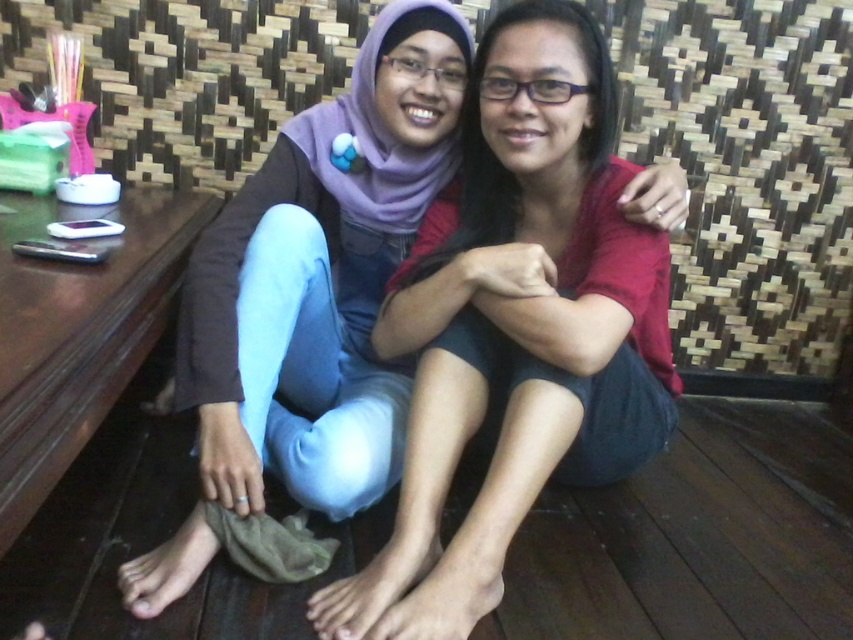
Does purple fabric hijab at center have a smaller size compared to brown wooden table at lower left?

Correct, purple fabric hijab at center occupies less space than brown wooden table at lower left.

Is point (485, 61) farther from viewer compared to point (140, 266)?

Yes, point (485, 61) is farther from viewer.

Is point (601, 138) more distant than point (18, 195)?

No, (601, 138) is in front of (18, 195).

The image size is (853, 640). I want to click on purple fabric hijab at center, so click(x=517, y=328).